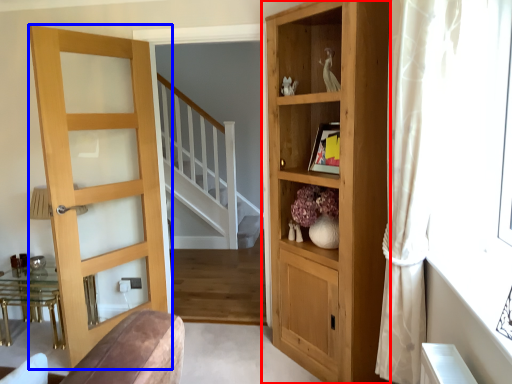
Question: Which point is further to the camera, cupboard (highlighted by a red box) or door (highlighted by a blue box)?

Choices:
 (A) cupboard
 (B) door

Answer: (B)